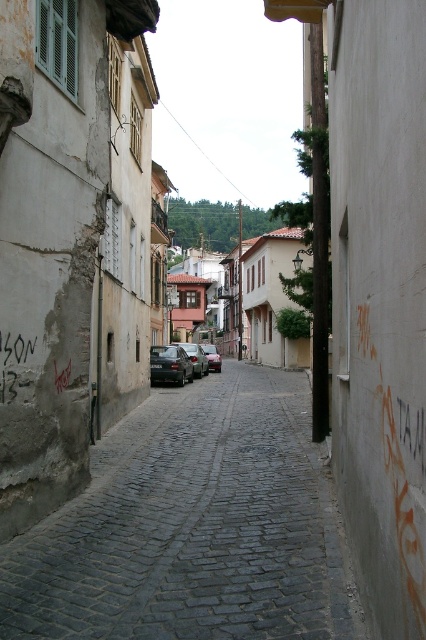
You are a delivery person trying to navigate through the narrow cobblestone street. You see the brown wooden house at center and the matte black car at center. Which object is taller and could potentially block your delivery vehicle from passing under it?

The brown wooden house at center is taller than the matte black car at center, so it could potentially block the delivery vehicle from passing under it.

You are a delivery driver trying to park your vehicle in this narrow cobblestone street. You see the brown wooden house at center and the matte black car at center. Which object is wider, and how might that affect your parking decision?

The brown wooden house at center is wider than the matte black car at center. Since the house is wider, it may indicate that there is limited space between the buildings for parking, so you should carefully assess the available space before attempting to park your vehicle.